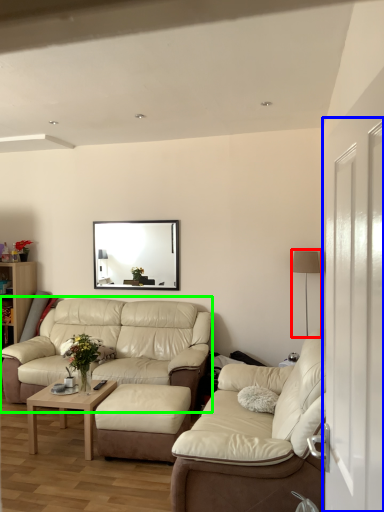
Question: Estimate the real-world distances between objects in this image. Which object is closer to lamp (highlighted by a red box), glass door (highlighted by a blue box) or studio couch (highlighted by a green box)?

Choices:
 (A) glass door
 (B) studio couch

Answer: (B)